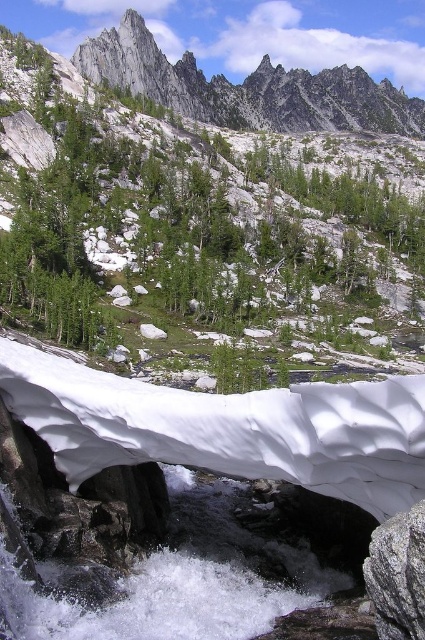
Who is more distant from viewer, (280, 129) or (410, 596)?

Positioned behind is point (280, 129).

Image resolution: width=425 pixels, height=640 pixels. Describe the element at coordinates (248, 88) in the screenshot. I see `rugged granite peaks at upper center` at that location.

I want to click on rugged granite peaks at upper center, so click(x=248, y=88).

Is green leafy hillside at upper center below gray rough rock at lower right?

No.

Does point (5, 106) come closer to viewer compared to point (405, 532)?

No, (5, 106) is further to viewer.

Image resolution: width=425 pixels, height=640 pixels. What are the coordinates of `green leafy hillside at upper center` in the screenshot? It's located at (206, 209).

Who is more distant from viewer, (138, 17) or (164, 58)?

The point (164, 58) is behind.

Between green leafy hillside at upper center and rugged granite peaks at upper center, which one has more height?

With more height is green leafy hillside at upper center.

Between point (130, 284) and point (365, 70), which one is positioned behind?

Point (365, 70)

This screenshot has height=640, width=425. I want to click on green leafy hillside at upper center, so click(x=206, y=209).